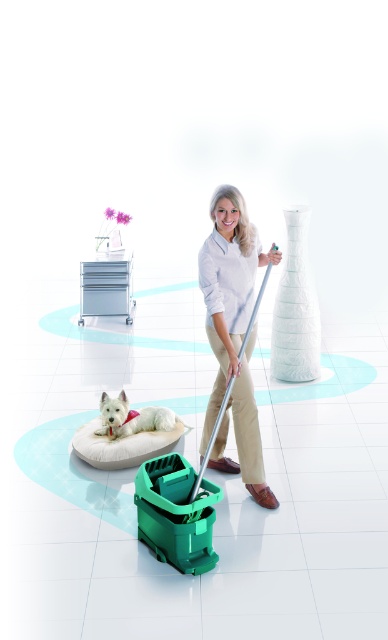
Question: Can you confirm if white fabric dog bed at lower left is bigger than white soft dog at lower left?

Choices:
 (A) yes
 (B) no

Answer: (A)

Question: Which of the following is the farthest from the observer?

Choices:
 (A) (150, 428)
 (B) (112, 460)

Answer: (A)

Question: Is the position of white matte shirt at center more distant than that of white soft dog at lower left?

Choices:
 (A) no
 (B) yes

Answer: (A)

Question: Does white matte shirt at center appear on the right side of white soft dog at lower left?

Choices:
 (A) yes
 (B) no

Answer: (A)

Question: Which point is farther to the camera?

Choices:
 (A) white fabric dog bed at lower left
 (B) white soft dog at lower left

Answer: (B)

Question: Estimate the real-world distances between objects in this image. Which object is closer to the white fabric dog bed at lower left?

Choices:
 (A) white soft dog at lower left
 (B) white matte shirt at center

Answer: (A)